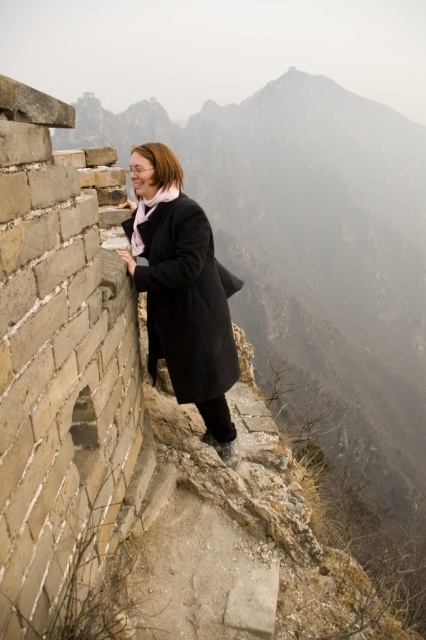
Who is shorter, gray stone wall at left or matte black coat at left?

Standing shorter between the two is matte black coat at left.

Is point (230, 208) less distant than point (132, 248)?

That is False.

Locate an element on the screen. This screenshot has height=640, width=426. gray stone wall at left is located at coordinates (314, 257).